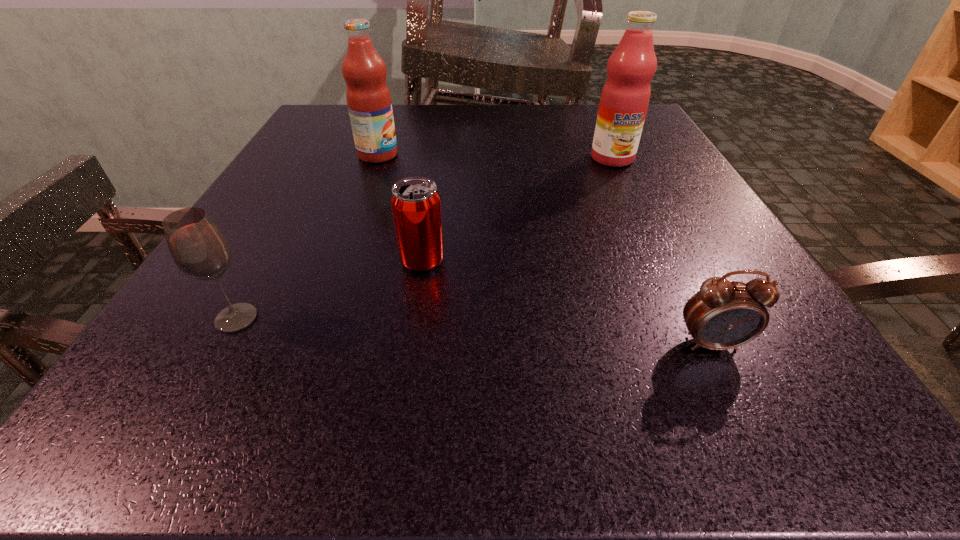
At what (x,y) coordinates should I click in order to perform the action: click on the right fruit juice. Please return your answer as a coordinate pair (x, y). This screenshot has height=540, width=960. Looking at the image, I should click on (625, 96).

Locate an element on the screen. the fourth object from right to left is located at coordinates (368, 97).

At what (x,y) coordinates should I click in order to perform the action: click on the third shortest object. Please return your answer as a coordinate pair (x, y). Looking at the image, I should click on (198, 247).

Locate an element on the screen. the leftmost object is located at coordinates click(198, 247).

The width and height of the screenshot is (960, 540). I want to click on the third farthest object, so click(x=415, y=202).

At what (x,y) coordinates should I click in order to perform the action: click on the third object from left to right. Please return your answer as a coordinate pair (x, y). The image size is (960, 540). Looking at the image, I should click on (415, 202).

Locate an element on the screen. This screenshot has width=960, height=540. alarm clock is located at coordinates (724, 314).

I want to click on vacant space located on the label of the right fruit juice, so click(660, 260).

Locate an element on the screen. The width and height of the screenshot is (960, 540). vacant space located 0.400m on the front label of the left fruit juice is located at coordinates (593, 155).

Locate an element on the screen. This screenshot has height=540, width=960. vacant space located 0.260m on the back of the third tallest object is located at coordinates pos(303,199).